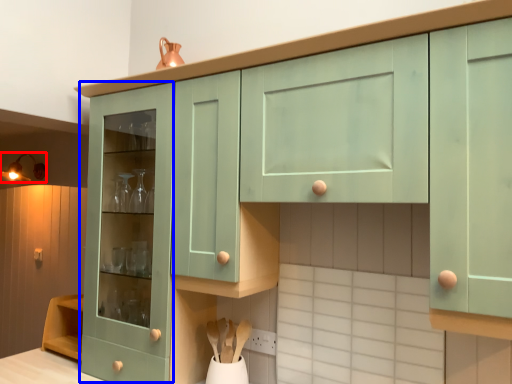
Question: Which object appears closest to the camera in this image, light fixture (highlighted by a red box) or cabinetry (highlighted by a blue box)?

Choices:
 (A) light fixture
 (B) cabinetry

Answer: (B)